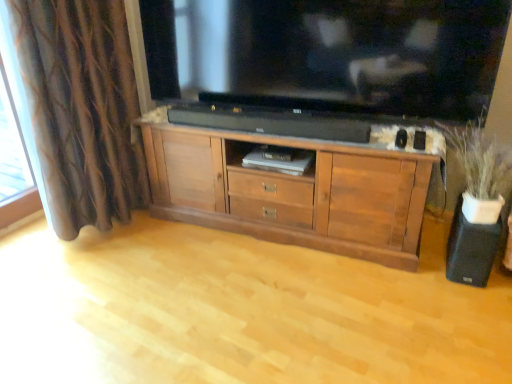
Question: Considering the relative positions of black matte speaker at lower right and brown wood cabinet at center in the image provided, is black matte speaker at lower right to the left of brown wood cabinet at center from the viewer's perspective?

Choices:
 (A) yes
 (B) no

Answer: (B)

Question: Considering the relative positions of black matte speaker at lower right and brown wood cabinet at center in the image provided, is black matte speaker at lower right to the right of brown wood cabinet at center from the viewer's perspective?

Choices:
 (A) yes
 (B) no

Answer: (A)

Question: Considering the relative sizes of black matte speaker at lower right and brown wood cabinet at center in the image provided, is black matte speaker at lower right thinner than brown wood cabinet at center?

Choices:
 (A) yes
 (B) no

Answer: (A)

Question: Is black matte speaker at lower right not near brown wood cabinet at center?

Choices:
 (A) no
 (B) yes

Answer: (A)

Question: From the image's perspective, is black matte speaker at lower right under brown wood cabinet at center?

Choices:
 (A) no
 (B) yes

Answer: (B)

Question: Is brown wood cabinet at center located within black matte speaker at lower right?

Choices:
 (A) yes
 (B) no

Answer: (B)

Question: Can you confirm if black glossy television at upper center is smaller than wooden cabinet at center?

Choices:
 (A) yes
 (B) no

Answer: (A)

Question: Is black glossy television at upper center further to the viewer compared to wooden cabinet at center?

Choices:
 (A) no
 (B) yes

Answer: (B)

Question: Is black glossy television at upper center positioned beyond the bounds of wooden cabinet at center?

Choices:
 (A) yes
 (B) no

Answer: (A)

Question: Does black glossy television at upper center have a lesser height compared to wooden cabinet at center?

Choices:
 (A) no
 (B) yes

Answer: (A)

Question: Does black glossy television at upper center have a lesser width compared to wooden cabinet at center?

Choices:
 (A) yes
 (B) no

Answer: (A)

Question: Is black glossy television at upper center with wooden cabinet at center?

Choices:
 (A) no
 (B) yes

Answer: (A)

Question: From the image's perspective, is brown textured curtain at left on top of black matte speaker at lower right?

Choices:
 (A) yes
 (B) no

Answer: (A)